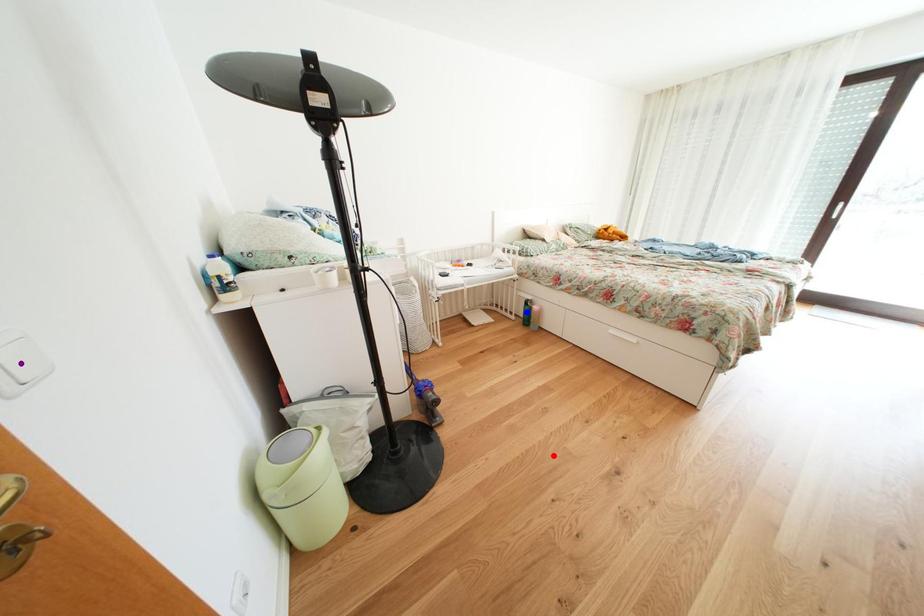
Order these from farthest to nearest:
purple point, blue point, red point

blue point
red point
purple point